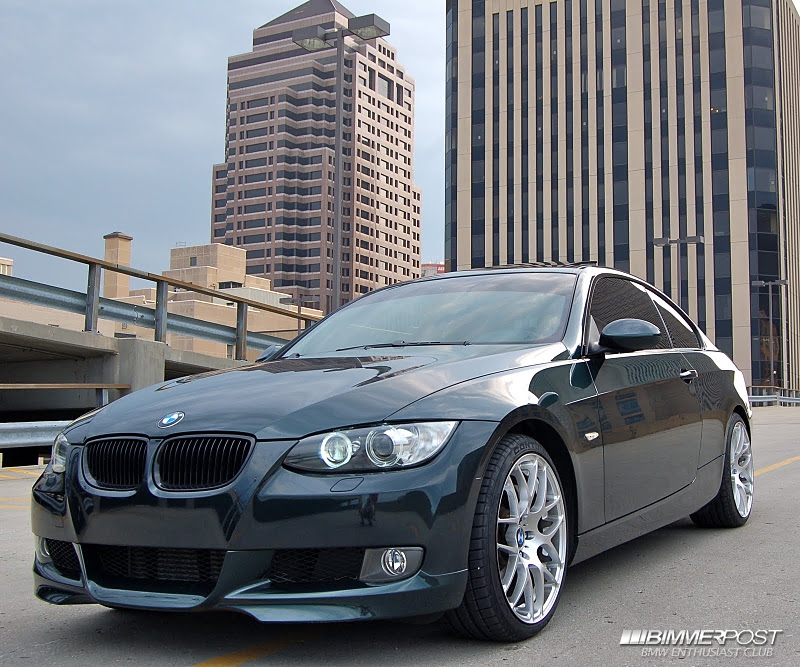
Where is `door handle`? door handle is located at coordinates (693, 379).